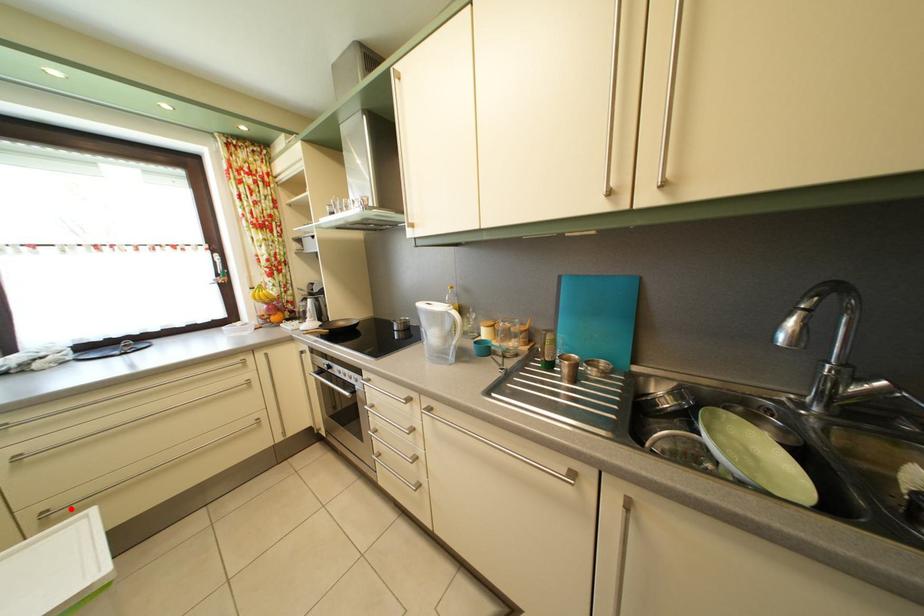
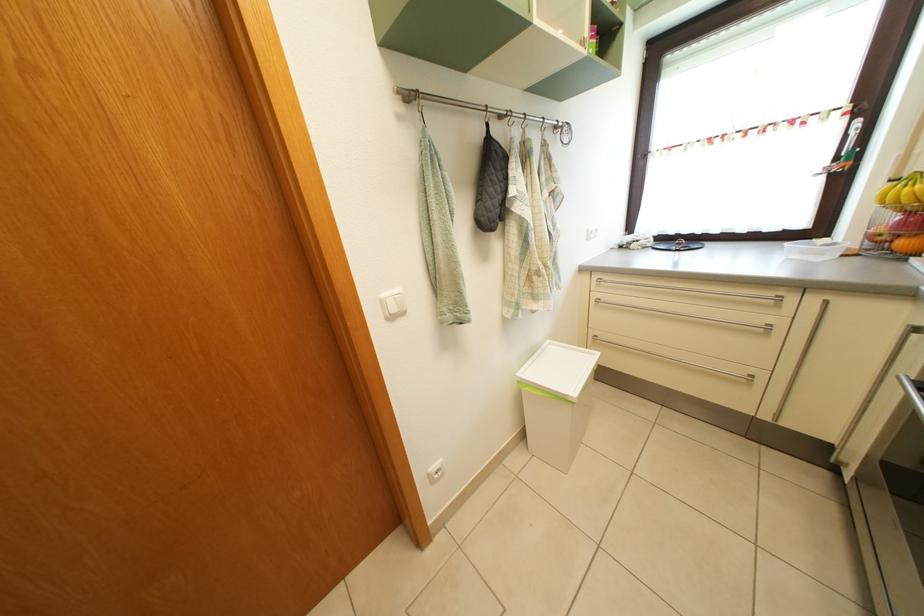
Locate, in the second image, the point that corresponds to the highlighted location in the first image.

(611, 344)